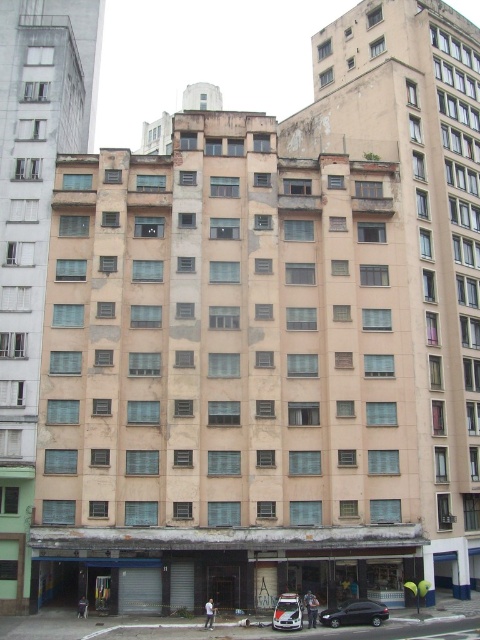
You are a delivery driver who needs to park your vehicle in this area. You see a black glossy car at lower center and a white glossy car at center. Is there enough space to park between them?

The black glossy car at lower center is positioned under the white glossy car at center, which means they are stacked vertically. Therefore, there is sufficient space between them to park your vehicle.

You are a delivery person who needs to park your 8.5 feet long delivery van between the black glossy car at lower center and the white glossy car at center. Can you fit your van between them without overlapping either car?

The distance between the black glossy car at lower center and the white glossy car at center is 9.59 feet. Since your van is 8.5 feet long, there is enough space to park it between them without overlapping either car.

You are a delivery person who needs to park your vehicle. You see a black glossy car at lower center and a white glossy car at center. Which car is wider and can accommodate a larger delivery truck parked next to it?

The black glossy car at lower center is wider than the white glossy car at center, so it can accommodate a larger delivery truck parked next to it.